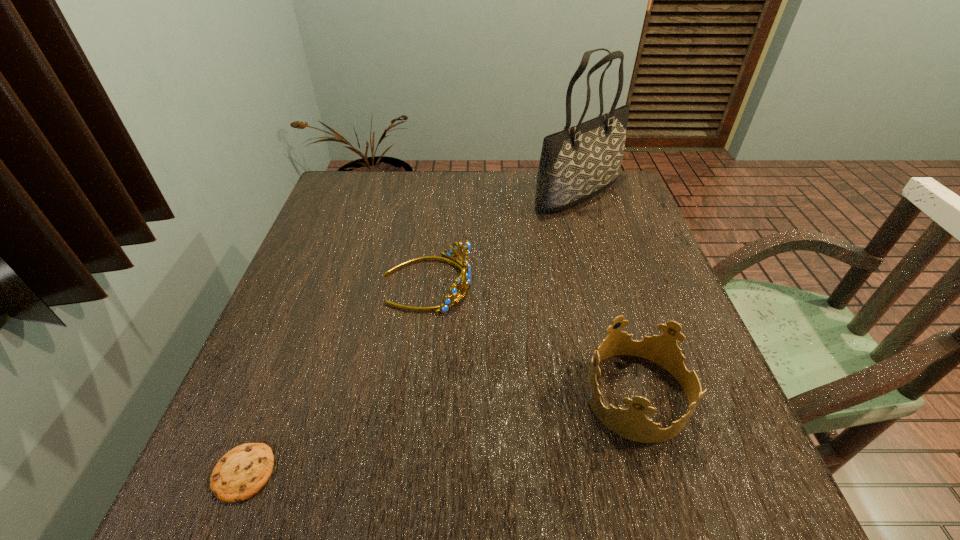
The height and width of the screenshot is (540, 960). Identify the location of tote bag. (577, 163).

This screenshot has width=960, height=540. I want to click on the tallest object, so click(577, 163).

The image size is (960, 540). What are the coordinates of `the left tiara` in the screenshot? It's located at click(464, 267).

Locate an element on the screen. This screenshot has height=540, width=960. the farther tiara is located at coordinates (464, 267).

I want to click on the right tiara, so click(631, 423).

Locate an element on the screen. The height and width of the screenshot is (540, 960). the nearer tiara is located at coordinates point(631,423).

At what (x,y) coordinates should I click in order to perform the action: click on the leftmost object. Please return your answer as a coordinate pair (x, y). Looking at the image, I should click on (242, 472).

The height and width of the screenshot is (540, 960). I want to click on the nearest object, so click(x=242, y=472).

Locate an element on the screen. vacant space located on the left of the farthest object is located at coordinates (443, 193).

This screenshot has width=960, height=540. Find the location of `free point located on the front-facing side of the second farthest object`. free point located on the front-facing side of the second farthest object is located at coordinates click(514, 283).